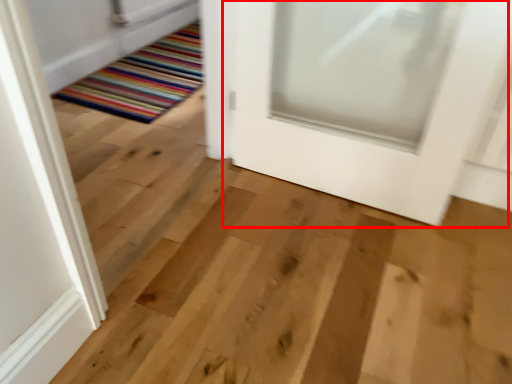
Question: From the image's perspective, where is door (annotated by the red box) located relative to mat?

Choices:
 (A) below
 (B) above

Answer: (A)